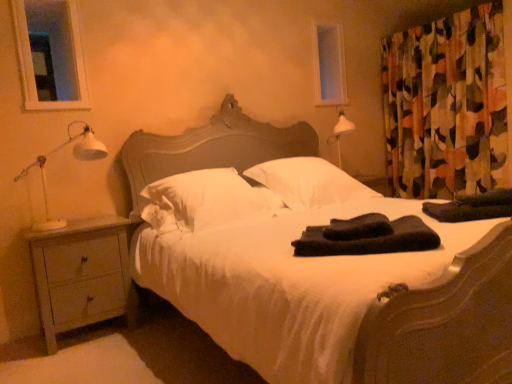
Question: Considering the positions of transparent glass window at upper left, the first window screen viewed from the left, and white matte table lamp at left in the image, is transparent glass window at upper left, the first window screen viewed from the left, wider or thinner than white matte table lamp at left?

Choices:
 (A) wide
 (B) thin

Answer: (B)

Question: Is transparent glass window at upper left, the 2th window screen positioned from the right, in front of or behind white matte table lamp at left in the image?

Choices:
 (A) front
 (B) behind

Answer: (B)

Question: Which is nearer to the white matte table lamp at left?

Choices:
 (A) black soft towel at center
 (B) white soft pillow at center, which appears as the 1th pillow when viewed from the right
 (C) transparent glass window screen at upper center, the 1th window screen from the right
 (D) abstract fabric curtain at right
 (E) black soft towels at center, the 1th material viewed from the left

Answer: (B)

Question: Estimate the real-world distances between objects in this image. Which object is farther from the black soft towel at center?

Choices:
 (A) white soft pillow at center, arranged as the 2th pillow when viewed from the left
 (B) white satin bed at center
 (C) abstract fabric curtain at right
 (D) transparent glass window at upper left, the 2th window screen positioned from the right
 (E) transparent glass window screen at upper center, the 1th window screen from the right

Answer: (D)